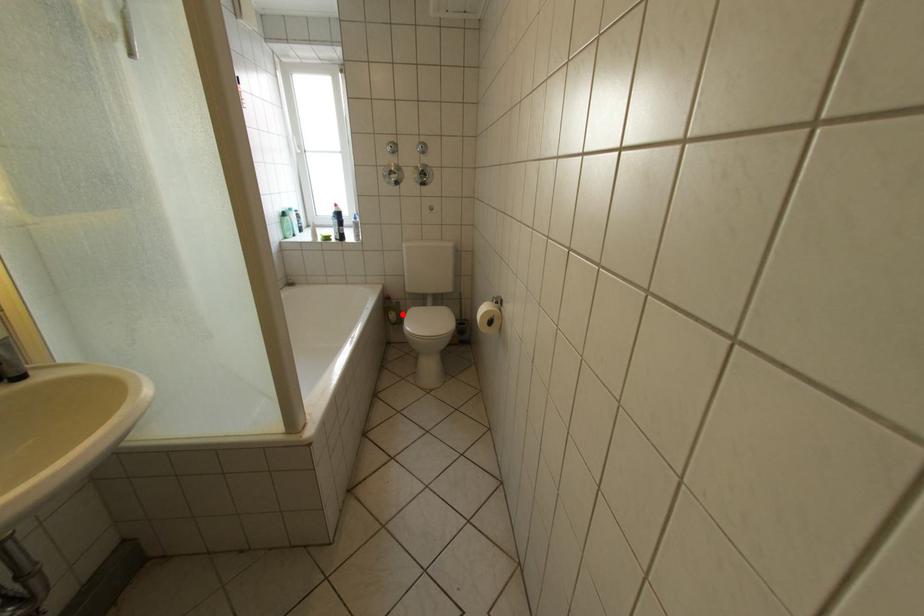
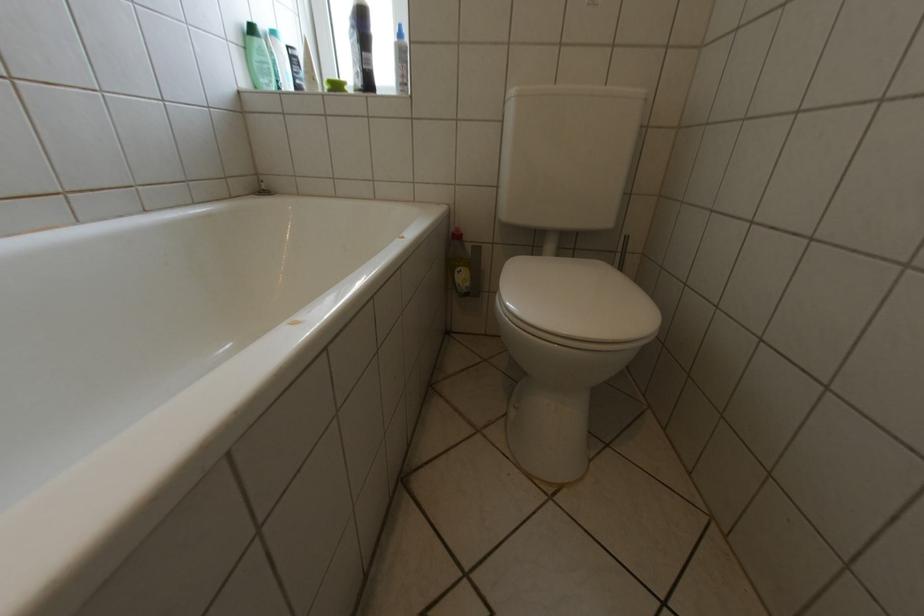
Find the pixel in the second image that matches the highlighted location in the first image.

(469, 270)